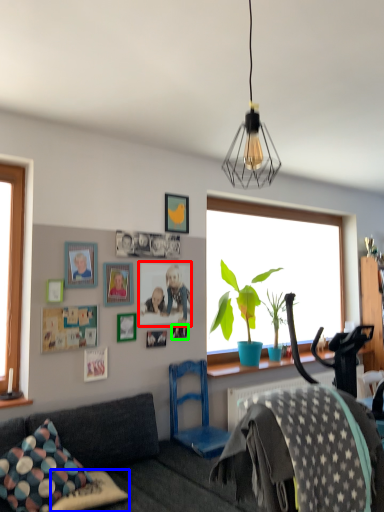
Question: Estimate the real-world distances between objects in this image. Which object is closer to picture frame (highlighted by a red box), pillow (highlighted by a blue box) or picture frame (highlighted by a green box)?

Choices:
 (A) pillow
 (B) picture frame

Answer: (B)